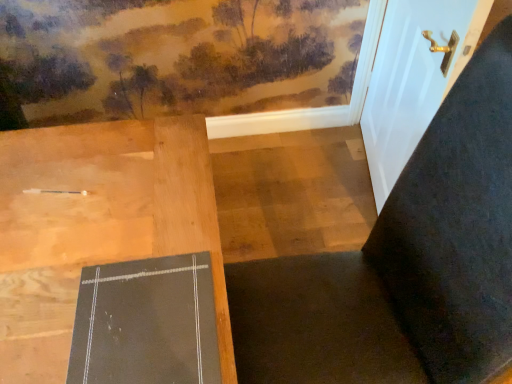
Question: Could you tell me if matte black bulletin board at center is turned towards dark fabric chair at center?

Choices:
 (A) no
 (B) yes

Answer: (A)

Question: Is matte black bulletin board at center in front of dark fabric chair at center?

Choices:
 (A) yes
 (B) no

Answer: (B)

Question: From a real-world perspective, is matte black bulletin board at center physically below dark fabric chair at center?

Choices:
 (A) no
 (B) yes

Answer: (A)

Question: From a real-world perspective, is matte black bulletin board at center over dark fabric chair at center?

Choices:
 (A) yes
 (B) no

Answer: (A)

Question: Does matte black bulletin board at center have a lesser width compared to dark fabric chair at center?

Choices:
 (A) yes
 (B) no

Answer: (A)

Question: Is matte black bulletin board at center wider than dark fabric chair at center?

Choices:
 (A) yes
 (B) no

Answer: (B)

Question: From a real-world perspective, is matte black bulletin board at center physically above white glossy door at upper right?

Choices:
 (A) yes
 (B) no

Answer: (A)

Question: From the image's perspective, is matte black bulletin board at center below white glossy door at upper right?

Choices:
 (A) yes
 (B) no

Answer: (A)

Question: Is matte black bulletin board at center positioned in front of white glossy door at upper right?

Choices:
 (A) yes
 (B) no

Answer: (A)

Question: Does matte black bulletin board at center appear on the right side of white glossy door at upper right?

Choices:
 (A) yes
 (B) no

Answer: (B)

Question: From a real-world perspective, is matte black bulletin board at center below white glossy door at upper right?

Choices:
 (A) yes
 (B) no

Answer: (B)

Question: Can you confirm if matte black bulletin board at center is smaller than white glossy door at upper right?

Choices:
 (A) no
 (B) yes

Answer: (B)

Question: Considering the relative sizes of white glossy door at upper right and matte black bulletin board at center in the image provided, is white glossy door at upper right bigger than matte black bulletin board at center?

Choices:
 (A) no
 (B) yes

Answer: (B)